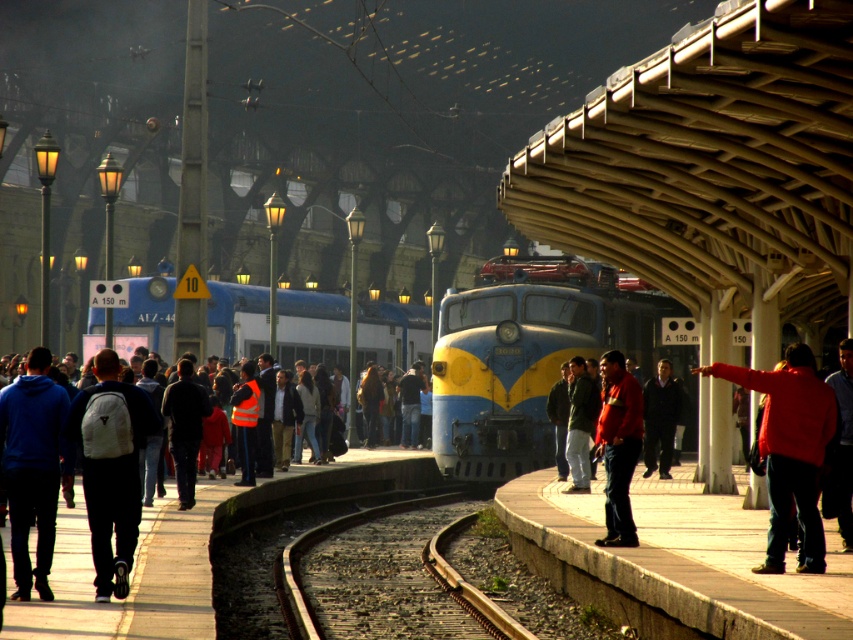
Question: Considering the relative positions of concrete platform at center and blue/yellow painted train at center in the image provided, where is concrete platform at center located with respect to blue/yellow painted train at center?

Choices:
 (A) left
 (B) right

Answer: (B)

Question: Which object appears farthest from the camera in this image?

Choices:
 (A) concrete platform at center
 (B) brown gravel train track at center
 (C) blue/yellow painted locomotive at center
 (D) blue/yellow painted train at center

Answer: (D)

Question: Is concrete platform at center positioned before brown gravel train track at center?

Choices:
 (A) no
 (B) yes

Answer: (B)

Question: Observing the image, what is the correct spatial positioning of blue/yellow painted train at center in reference to brown gravel train track at center?

Choices:
 (A) right
 (B) left

Answer: (B)

Question: Among these points, which one is farthest from the camera?

Choices:
 (A) (318, 544)
 (B) (112, 472)
 (C) (564, 298)

Answer: (C)

Question: Among these objects, which one is nearest to the camera?

Choices:
 (A) blue/yellow painted locomotive at center
 (B) blue/yellow painted train at center

Answer: (A)